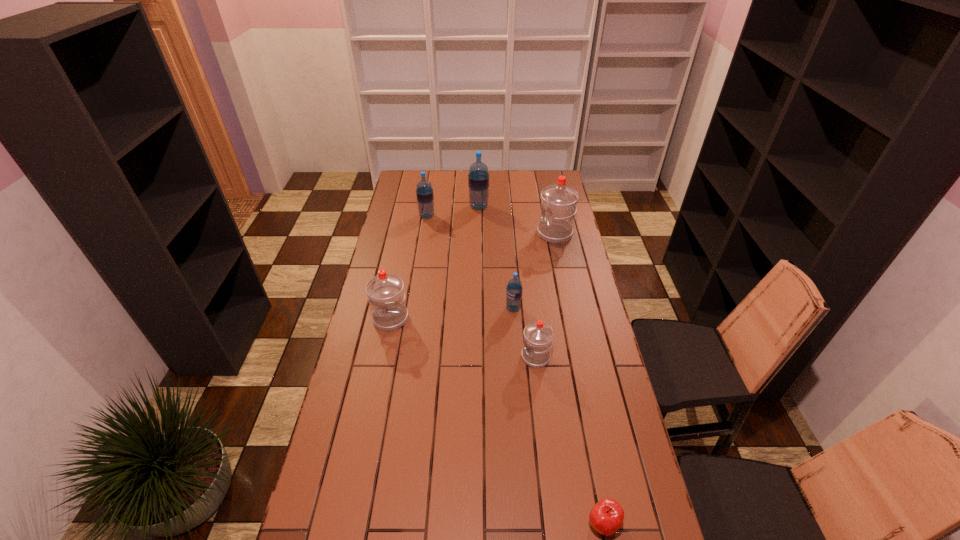
You are a GUI agent. You are given a task and a screenshot of the screen. Output one action in this format:
    pyautogui.click(x=<x>, y=<y>)
    Task: Click on the vacant space located on the handle side of the second white water bottle from right to left
    Image resolution: width=960 pixels, height=540 pixels.
    Given the screenshot: What is the action you would take?
    pyautogui.click(x=459, y=357)

What are the coordinates of `object that is positioned at the right edge` in the screenshot? It's located at (559, 201).

Where is `blank space at the far edge`? blank space at the far edge is located at coordinates (497, 190).

Find the location of `vacant space at the left edge of the desktop`. vacant space at the left edge of the desktop is located at coordinates (380, 372).

At what (x,y) coordinates should I click in order to perform the action: click on free point at the right edge. Please return your answer as a coordinate pair (x, y). The width and height of the screenshot is (960, 540). Looking at the image, I should click on (576, 376).

The image size is (960, 540). I want to click on blank space at the far right corner, so click(x=550, y=172).

Find the location of a particular element. Image resolution: width=960 pixels, height=540 pixels. free spot between the rightmost blue water bottle and the leftmost white water bottle is located at coordinates (452, 314).

The image size is (960, 540). Find the location of `vacant region between the second biggest blue water bottle and the sixth farthest object`. vacant region between the second biggest blue water bottle and the sixth farthest object is located at coordinates (481, 287).

You are a GUI agent. You are given a task and a screenshot of the screen. Output one action in this format:
    pyautogui.click(x=<x>, y=<y>)
    Task: Click on the unoccupied area between the smallest white water bottle and the second smallest blue water bottle
    The height and width of the screenshot is (540, 960).
    Given the screenshot: What is the action you would take?
    pyautogui.click(x=481, y=287)

At what (x,y) coordinates should I click in order to perform the action: click on the sixth closest object to the third water bottle from left to right. Please return your answer as a coordinate pair (x, y). The height and width of the screenshot is (540, 960). Looking at the image, I should click on (606, 517).